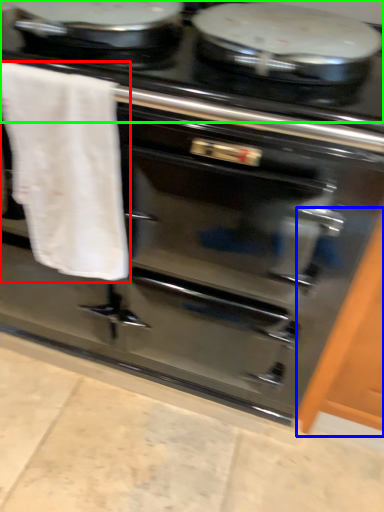
Question: Which is farther away from bath towel (highlighted by a red box)? cabinetry (highlighted by a blue box) or gas stove (highlighted by a green box)?

Choices:
 (A) cabinetry
 (B) gas stove

Answer: (A)